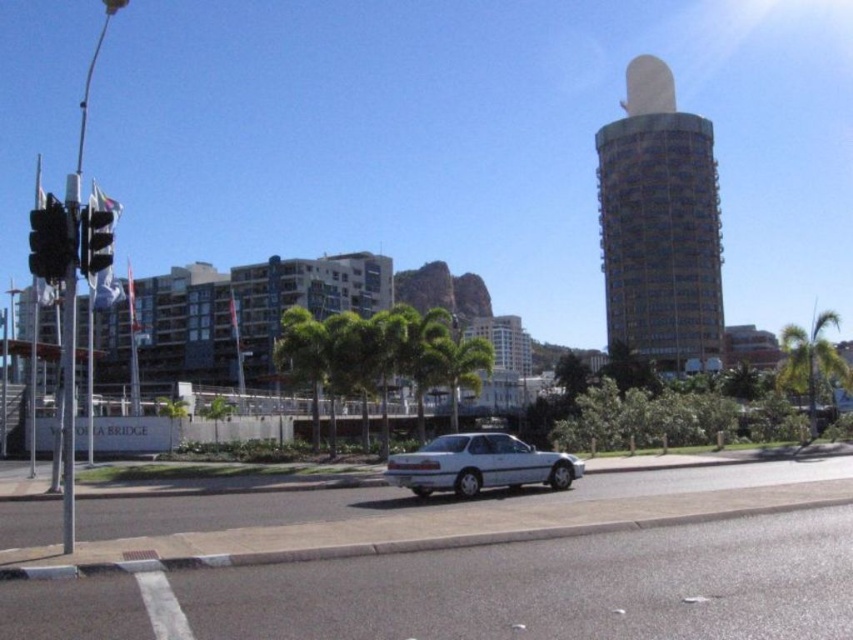
You are standing at the intersection and want to take a photo of the green leafy palm tree at center. If you are facing north, which direction should you turn to frame the palm tree in your camera?

The green leafy palm tree at center is located at coordinates point (457, 365). Since you are facing north, you need to turn to the east to frame the palm tree in your camera.

You are a pedestrian standing on the sidewalk next to the traffic light pole. You want to cross the road to reach the palm tree. Is the white metallic car at center blocking your path to the green leafy palm tree at right?

The white metallic car at center is positioned on the left side of the green leafy palm tree at right, so it is blocking your path to the green leafy palm tree at right.

You are a photographer positioned at the camera location. You want to capture both the white car driving towards the right and the traffic light pole on the left in your photo. However, you notice that one of the points, point 1 at coordinates point (480, 458) or point 2 at coordinates point (49, 260), is closer to the camera. Which point is closer to your current position?

Point (49, 260) is closer to the camera because the Objects Description states that point (480, 458) is further to the camera than point (49, 260).